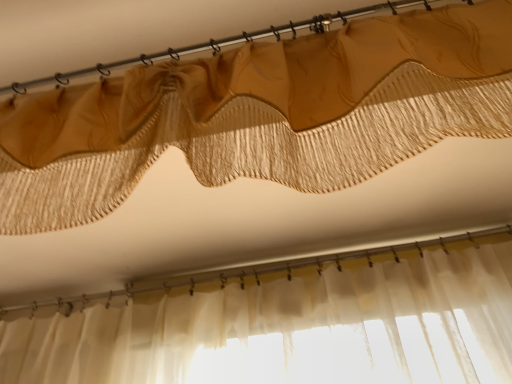
Question: Considering the positions of matte gold curtain at upper center and matte gold curtain at upper center in the image, is matte gold curtain at upper center bigger or smaller than matte gold curtain at upper center?

Choices:
 (A) small
 (B) big

Answer: (A)

Question: Considering the positions of point (158, 57) and point (224, 71), is point (158, 57) closer or farther from the camera than point (224, 71)?

Choices:
 (A) farther
 (B) closer

Answer: (A)

Question: Considering the positions of matte gold curtain at upper center and matte gold curtain at upper center in the image, is matte gold curtain at upper center wider or thinner than matte gold curtain at upper center?

Choices:
 (A) wide
 (B) thin

Answer: (A)

Question: From a real-world perspective, is matte gold curtain at upper center positioned above or below matte gold curtain at upper center?

Choices:
 (A) below
 (B) above

Answer: (A)

Question: Do you think matte gold curtain at upper center is within matte gold curtain at upper center, or outside of it?

Choices:
 (A) outside
 (B) inside

Answer: (A)

Question: Relative to matte gold curtain at upper center, is matte gold curtain at upper center in front or behind?

Choices:
 (A) front
 (B) behind

Answer: (A)

Question: Is point (505, 102) closer or farther from the camera than point (293, 23)?

Choices:
 (A) farther
 (B) closer

Answer: (B)